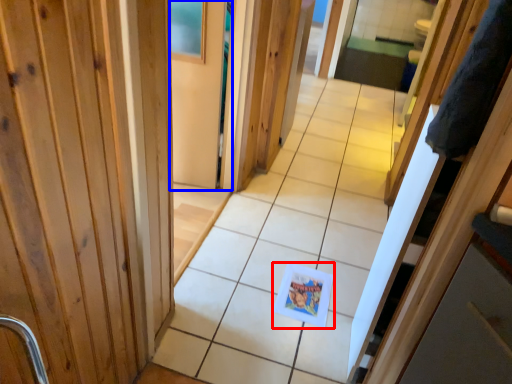
Question: Which of the following is the farthest to the observer, postcard (highlighted by a red box) or screen door (highlighted by a blue box)?

Choices:
 (A) postcard
 (B) screen door

Answer: (B)